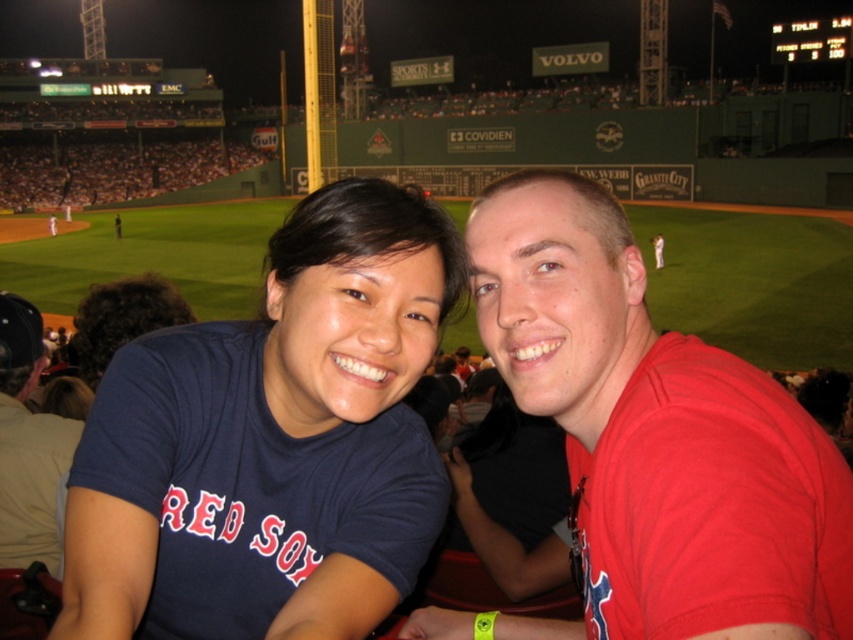
Question: Which of the following is the closest to the observer?

Choices:
 (A) matte blue shirt at center
 (B) red matte baseball glove at center
 (C) red matte shirt at center
 (D) navy blue t-shirt at center

Answer: (C)

Question: Can you confirm if navy blue t-shirt at center is smaller than red matte baseball glove at center?

Choices:
 (A) yes
 (B) no

Answer: (B)

Question: Can you confirm if navy blue t-shirt at center is wider than red matte baseball glove at center?

Choices:
 (A) no
 (B) yes

Answer: (B)

Question: In this image, where is matte blue shirt at center located relative to red matte baseball glove at center?

Choices:
 (A) right
 (B) left

Answer: (B)

Question: Which object appears farthest from the camera in this image?

Choices:
 (A) matte blue shirt at center
 (B) navy blue t-shirt at center

Answer: (A)

Question: Considering the real-world distances, which object is closest to the red matte shirt at center?

Choices:
 (A) red matte baseball glove at center
 (B) navy blue t-shirt at center
 (C) matte blue shirt at center

Answer: (B)